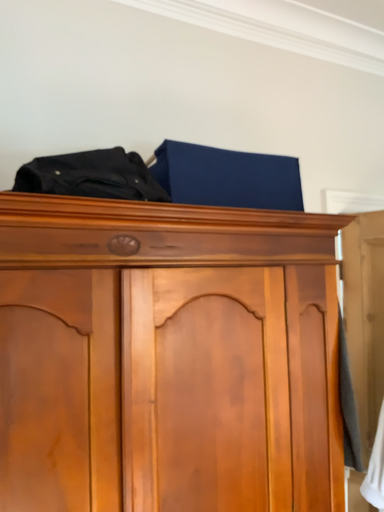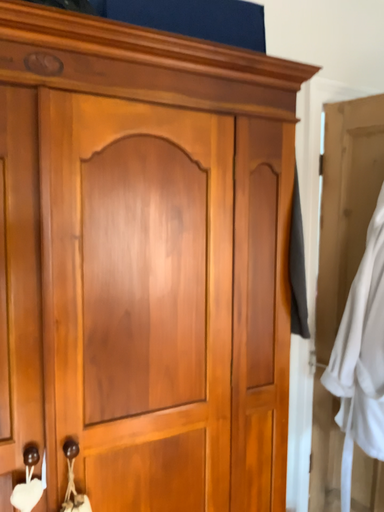
Question: Which way did the camera rotate in the video?

Choices:
 (A) rotated upward
 (B) rotated downward

Answer: (B)